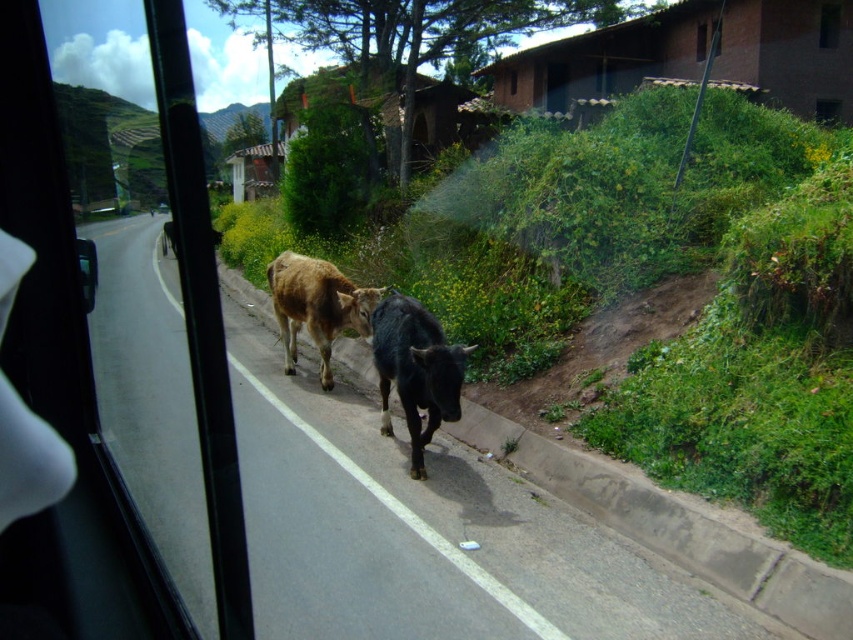
Is transparent glass car window at left to the left of brown glossy cow at center from the viewer's perspective?

Correct, you'll find transparent glass car window at left to the left of brown glossy cow at center.

Which is below, transparent glass car window at left or brown glossy cow at center?

Positioned lower is brown glossy cow at center.

Who is more forward, (167, 166) or (312, 300)?

Point (167, 166)

This screenshot has height=640, width=853. In order to click on transparent glass car window at left in this screenshot , I will do `click(163, 312)`.

Who is positioned more to the right, transparent glass car window at left or black glossy cow at center?

black glossy cow at center

Is transparent glass car window at left behind black glossy cow at center?

No.

Which is in front, point (189, 60) or point (374, 365)?

Positioned in front is point (189, 60).

Locate an element on the screen. transparent glass car window at left is located at coordinates (163, 312).

What do you see at coordinates (415, 371) in the screenshot? I see `black glossy cow at center` at bounding box center [415, 371].

Who is positioned more to the right, black glossy cow at center or brown glossy cow at center?

black glossy cow at center

Is point (376, 353) more distant than point (334, 333)?

No, (376, 353) is closer to viewer.

Where is `black glossy cow at center`? The height and width of the screenshot is (640, 853). black glossy cow at center is located at coordinates (415, 371).